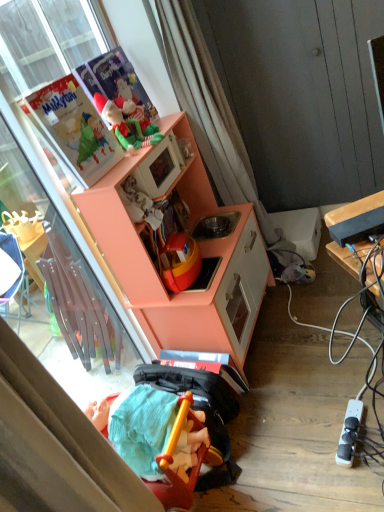
Identify the location of vacant region to the left of white plastic power outlet at lower right. (300, 450).